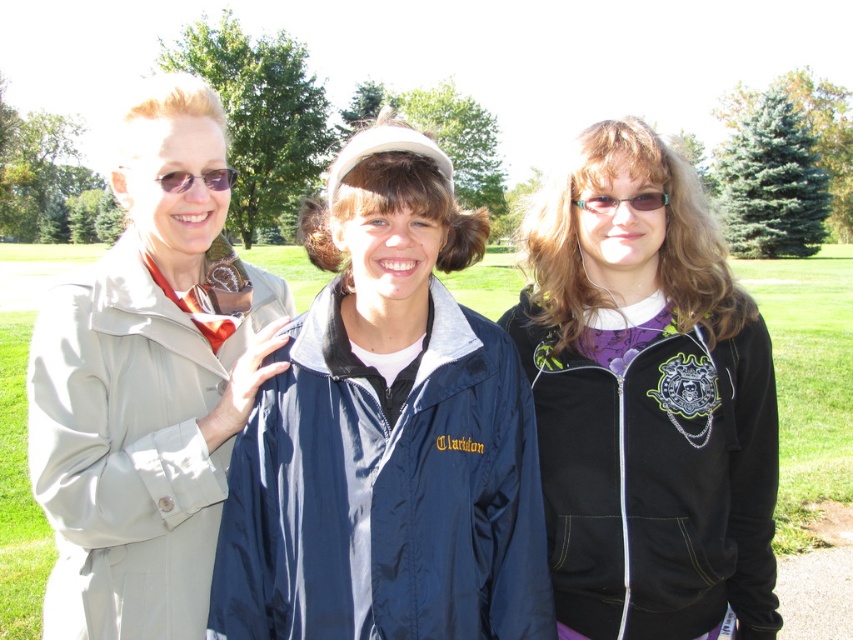
You are a photographer trying to capture a group photo of the three people in the park. You want to ensure that the navy blue jacket at center and the matte black sunglasses at upper left are both visible in the frame. Based on their positions, which object is closer to the camera?

The navy blue jacket at center is positioned under the matte black sunglasses at upper left, meaning the sunglasses are closer to the camera than the jacket.

You are a photographer trying to capture a clear shot of the matte plastic glasses at center. However, the matte beige trench coat at left is blocking your view. Can you move around to the left side of the trench coat to get an unobstructed view of the glasses?

The matte beige trench coat at left is in front of the matte plastic glasses at center, so moving to the left side of the trench coat may still leave the glasses obstructed. You might need to move to the right side of the trench coat to see the glasses clearly.